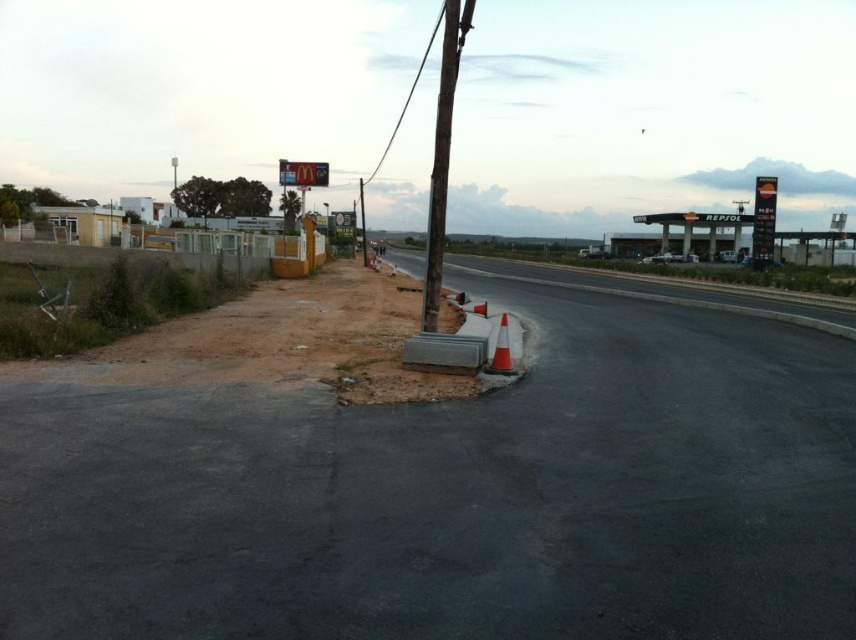
You are a delivery driver who needs to deliver a package to a specific location marked by a point on the black asphalt highway at center. The GPS shows the point at coordinates (453, 496). Based on the scene description, where should you look for this point along the road?

The point at coordinates (453, 496) is located on the black asphalt highway at center, so you should look along the central part of the road where the asphalt is dark gray and smooth.

You are a construction worker who needs to place a new sign on the pole. The sign requires a sturdy base to withstand wind. Which pole should you choose between the brown wooden pole at center and the smooth concrete pole at center?

The smooth concrete pole at center is positioned above the brown wooden pole at center, so it is likely taller and sturdier, making it the better choice for the sign.